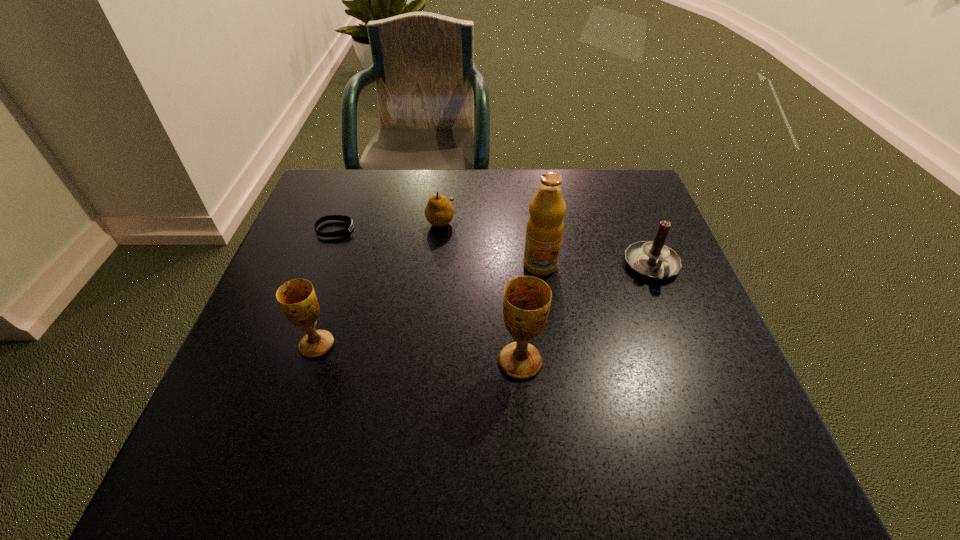
Image resolution: width=960 pixels, height=540 pixels. I want to click on free space that is in between the shortest object and the shorter chalice, so click(326, 287).

Where is `free space between the right chalice and the fifth tallest object`? The height and width of the screenshot is (540, 960). free space between the right chalice and the fifth tallest object is located at coordinates (480, 291).

The height and width of the screenshot is (540, 960). What are the coordinates of `free area in between the fourth tallest object and the shortest object` in the screenshot? It's located at (493, 248).

Find the location of `free space between the rightmost object and the shortest object`. free space between the rightmost object and the shortest object is located at coordinates (493, 248).

Locate an element on the screen. The height and width of the screenshot is (540, 960). the third closest object relative to the wristband is located at coordinates (545, 226).

You are a GUI agent. You are given a task and a screenshot of the screen. Output one action in this format:
    pyautogui.click(x=<x>, y=<y>)
    Task: Click on the closest object to the second shortest object
    The image size is (960, 540).
    Given the screenshot: What is the action you would take?
    pyautogui.click(x=346, y=231)

The height and width of the screenshot is (540, 960). I want to click on vacant space that satisfies the following two spatial constraints: 1. on the display of the wristband; 2. on the left side of the taller chalice, so click(x=286, y=362).

Image resolution: width=960 pixels, height=540 pixels. Find the location of `free location that satisfies the following two spatial constraints: 1. on the display of the shortest object; 2. on the left side of the fourth shortest object`. free location that satisfies the following two spatial constraints: 1. on the display of the shortest object; 2. on the left side of the fourth shortest object is located at coordinates (293, 345).

Find the location of a particular element. The height and width of the screenshot is (540, 960). vacant space that satisfies the following two spatial constraints: 1. on the front side of the right chalice; 2. on the left side of the pear is located at coordinates (426, 362).